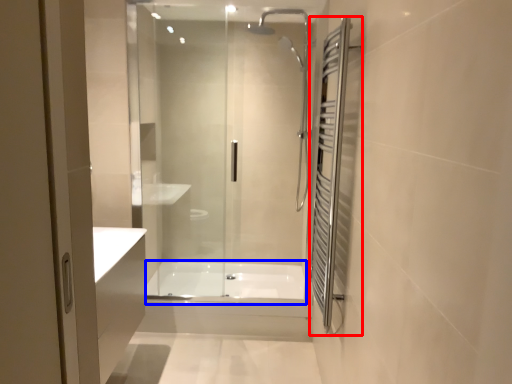
Question: Which object appears farthest to the camera in this image, screen door (highlighted by a red box) or bath (highlighted by a blue box)?

Choices:
 (A) screen door
 (B) bath

Answer: (B)